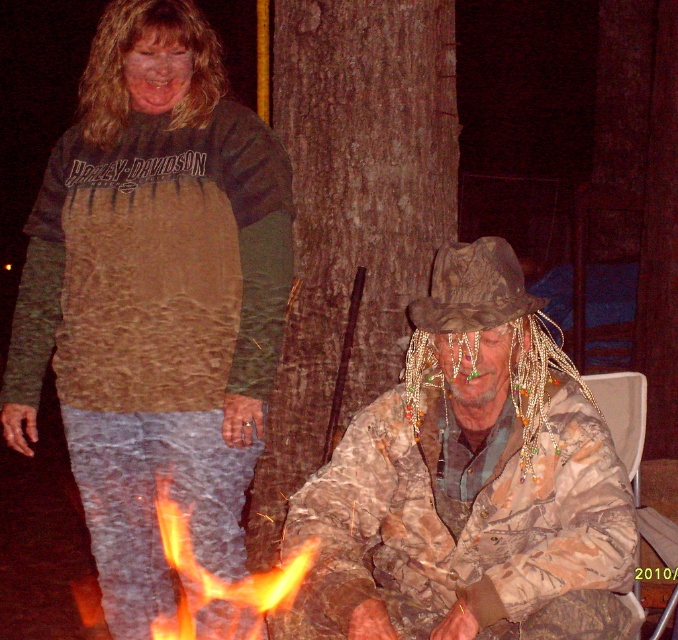
Who is positioned more to the right, camouflage fabric jacket at lower center or brown rough bark at center?

camouflage fabric jacket at lower center

At what (x,y) coordinates should I click in order to perform the action: click on camouflage fabric jacket at lower center. Please return your answer as a coordinate pair (x, y). Looking at the image, I should click on (471, 484).

Between point (597, 419) and point (325, 292), which one is positioned in front?

Point (597, 419)

Image resolution: width=678 pixels, height=640 pixels. Find the location of `camouflage fabric jacket at lower center`. camouflage fabric jacket at lower center is located at coordinates (471, 484).

Which is in front, point (292, 561) or point (477, 256)?

Point (292, 561) is in front.

Does flameflame at lower center appear over camouflage fabric cowboy hat at center?

No.

Is point (231, 589) positioned behind point (462, 285)?

Yes, it is behind point (462, 285).

Locate an element on the screen. flameflame at lower center is located at coordinates coord(216,582).

Who is taller, camouflage fabric jacket at lower center or camouflage fabric cowboy hat at center?

camouflage fabric jacket at lower center is taller.

Locate an element on the screen. camouflage fabric jacket at lower center is located at coordinates (471, 484).

Locate an element on the screen. The image size is (678, 640). camouflage fabric jacket at lower center is located at coordinates (471, 484).